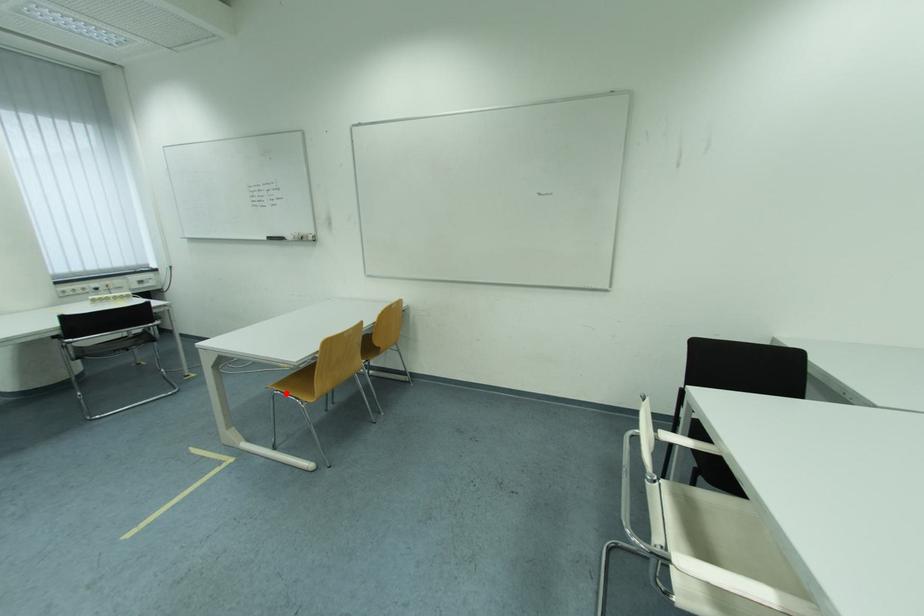
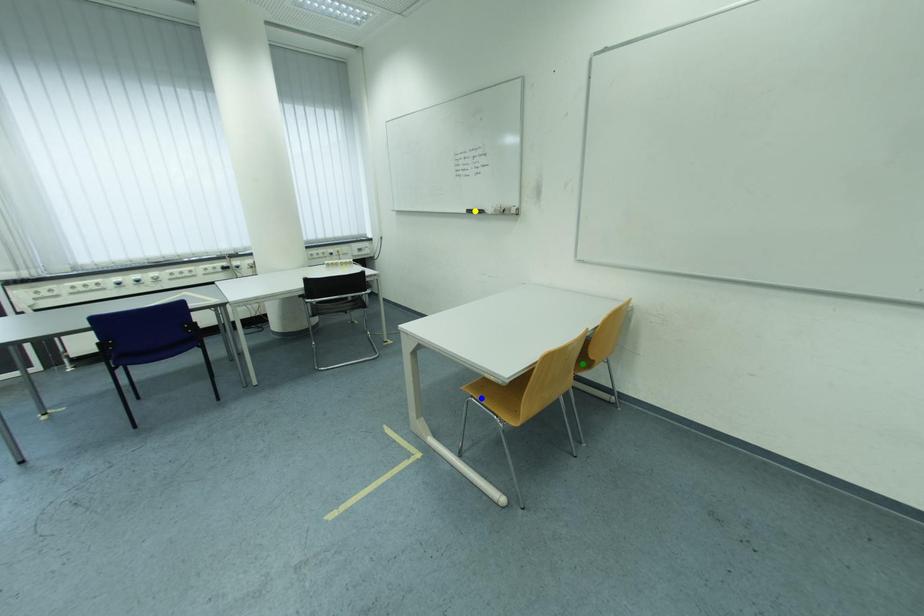
Question: I am providing you with two images of the same scene from different viewpoints. A red point is marked on the first image. You are given multiple points on the second image. Which mark in image 2 goes with the point in image 1?

Choices:
 (A) blue point
 (B) green point
 (C) yellow point

Answer: (A)